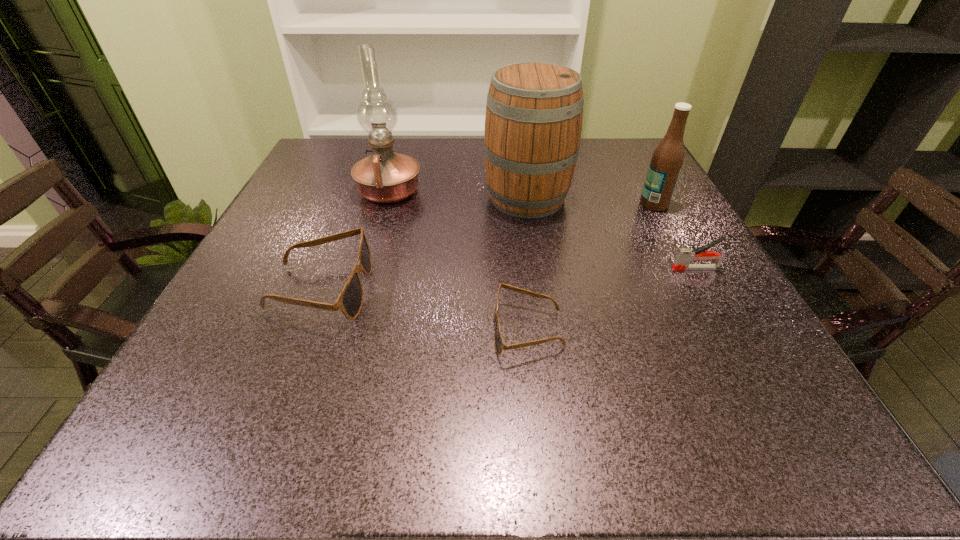
This screenshot has height=540, width=960. What are the coordinates of `vacant position at the near right corner of the desktop` in the screenshot? It's located at (688, 374).

Identify the location of vacant area that lies between the beer bottle and the taller sunglasses. This screenshot has width=960, height=540. (488, 246).

I want to click on vacant space in between the left sunglasses and the oil lamp, so click(355, 240).

This screenshot has height=540, width=960. Find the location of `unoccupied position between the cider and the stapler`. unoccupied position between the cider and the stapler is located at coordinates (612, 233).

Where is `free spot between the oil lamp and the stapler`? The height and width of the screenshot is (540, 960). free spot between the oil lamp and the stapler is located at coordinates (542, 230).

You are a GUI agent. You are given a task and a screenshot of the screen. Output one action in this format:
    pyautogui.click(x=<x>, y=<y>)
    Task: Click on the free space between the left sunglasses and the second tallest object
    This screenshot has height=540, width=960.
    Given the screenshot: What is the action you would take?
    pyautogui.click(x=424, y=243)

Identify the location of free space between the right sunglasses and the oil lamp. The image size is (960, 540). (458, 261).

Find the location of a particular element. The height and width of the screenshot is (540, 960). vacant point located between the taller sunglasses and the fourth shortest object is located at coordinates (488, 246).

What are the coordinates of `vacant point located between the oil lamp and the taller sunglasses` in the screenshot? It's located at (355, 240).

What are the coordinates of `empty space that is in between the fifth shortest object and the stapler` in the screenshot? It's located at (612, 233).